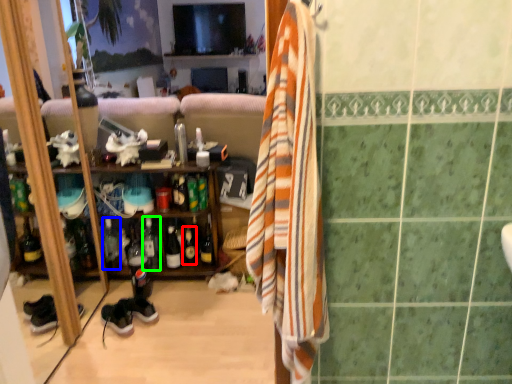
Question: Considering the real-world distances, which object is farthest from bottle (highlighted by a red box)? bottle (highlighted by a blue box) or bottle (highlighted by a green box)?

Choices:
 (A) bottle
 (B) bottle

Answer: (A)